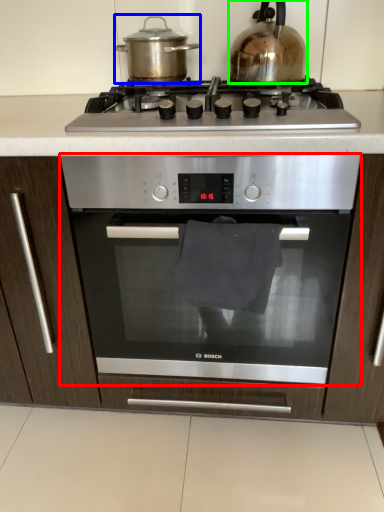
Question: Based on their relative distances, which object is nearer to oven (highlighted by a red box)? Choose from kitchen appliance (highlighted by a blue box) and kitchen appliance (highlighted by a green box).

Choices:
 (A) kitchen appliance
 (B) kitchen appliance

Answer: (B)